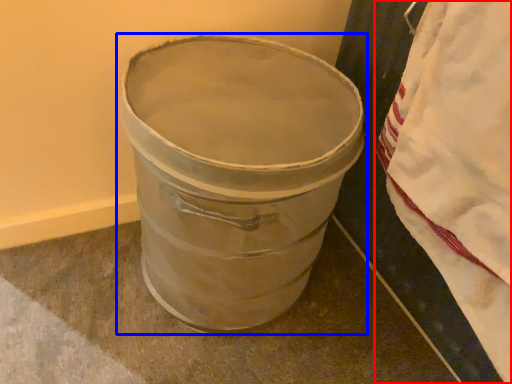
Question: Which object is closer to the camera taking this photo, blanket (highlighted by a red box) or waste container (highlighted by a blue box)?

Choices:
 (A) blanket
 (B) waste container

Answer: (A)